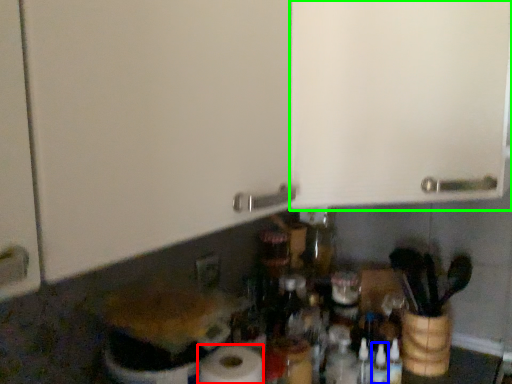
Question: Which is nearer to the paper towel (highlighted by a red box)? bottle (highlighted by a blue box) or cabinetry (highlighted by a green box).

Choices:
 (A) bottle
 (B) cabinetry

Answer: (A)